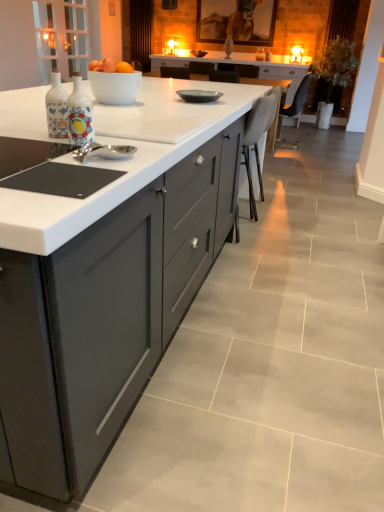
This screenshot has width=384, height=512. I want to click on free space to the left of decorative ceramic bottle at center-left, so click(25, 137).